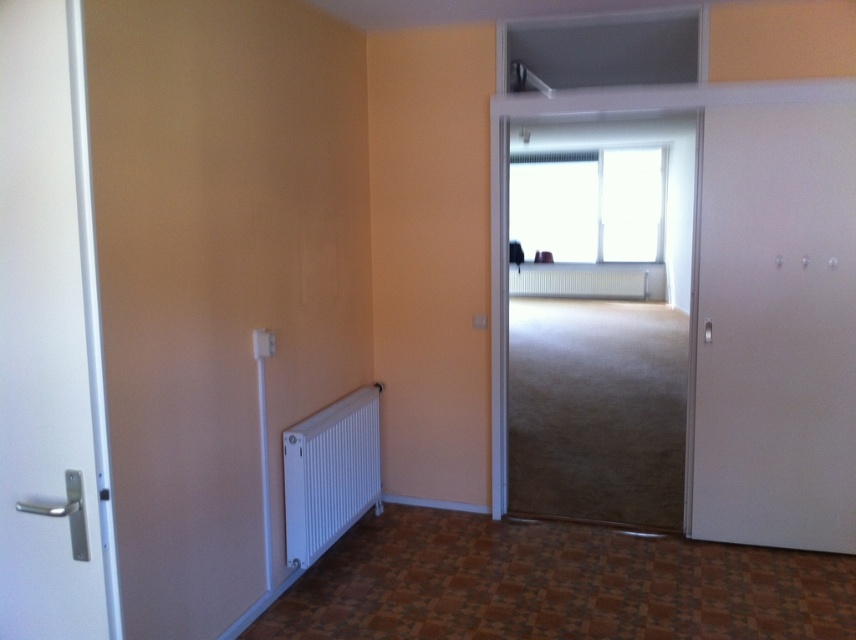
Based on the photo, you are standing in the center of the room and need to exit through the white matte door at left. Based on the spatial layout described, in which direction should you walk to reach the door?

The white matte door at left is located at point (x=51, y=340), so you should walk to the left side of the room to reach the white matte door at left.

You are moving a sofa that is 3 meters long into this room. The sofa is currently positioned outside the room, near the white matte door at right. You need to maneuver it through the entrance. Can the sofa fit through the doorway if you move it straight in?

The distance between the white matte door at right and the white door with silver handle is 3.10 meters. Since the sofa is 3 meters long, it can fit through the doorway if moved straight in, as the available space is slightly larger than the sofa.

You are standing in the room and want to exit through the white matte door at left. However, you notice the white matte radiator at center is blocking your path. Can you walk around it to reach the door?

The white matte door at left is closer to the viewer than the white matte radiator at center, so the radiator is further away. This means the radiator is not blocking the path to the door, so you can walk straight to the door without needing to go around it.